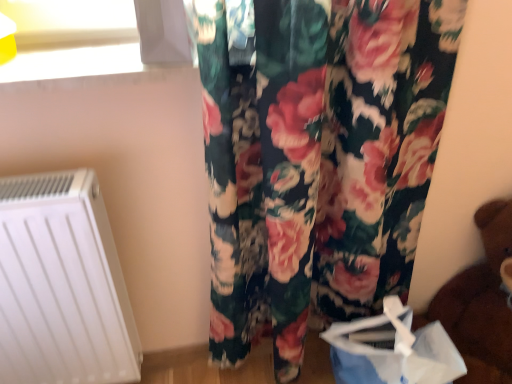
Question: Is white matte radiator at lower left behind brown plush bear at lower right?

Choices:
 (A) no
 (B) yes

Answer: (B)

Question: Is white matte radiator at lower left far away from brown plush bear at lower right?

Choices:
 (A) yes
 (B) no

Answer: (A)

Question: Is brown plush bear at lower right a part of white matte radiator at lower left?

Choices:
 (A) no
 (B) yes

Answer: (A)

Question: Are white matte radiator at lower left and brown plush bear at lower right making contact?

Choices:
 (A) no
 (B) yes

Answer: (A)

Question: Is white matte radiator at lower left at the left side of brown plush bear at lower right?

Choices:
 (A) no
 (B) yes

Answer: (B)

Question: Does white matte radiator at lower left have a lesser height compared to brown plush bear at lower right?

Choices:
 (A) no
 (B) yes

Answer: (A)

Question: Is brown plush bear at lower right in front of blue paper bag at lower right?

Choices:
 (A) yes
 (B) no

Answer: (A)

Question: Is brown plush bear at lower right not within blue paper bag at lower right?

Choices:
 (A) no
 (B) yes

Answer: (B)

Question: Is brown plush bear at lower right facing away from blue paper bag at lower right?

Choices:
 (A) no
 (B) yes

Answer: (A)

Question: Is brown plush bear at lower right far from blue paper bag at lower right?

Choices:
 (A) no
 (B) yes

Answer: (A)

Question: Considering the relative sizes of brown plush bear at lower right and blue paper bag at lower right in the image provided, is brown plush bear at lower right bigger than blue paper bag at lower right?

Choices:
 (A) no
 (B) yes

Answer: (B)

Question: Could blue paper bag at lower right be considered to be inside brown plush bear at lower right?

Choices:
 (A) no
 (B) yes

Answer: (A)

Question: Does white matte radiator at lower left come in front of blue paper bag at lower right?

Choices:
 (A) no
 (B) yes

Answer: (B)